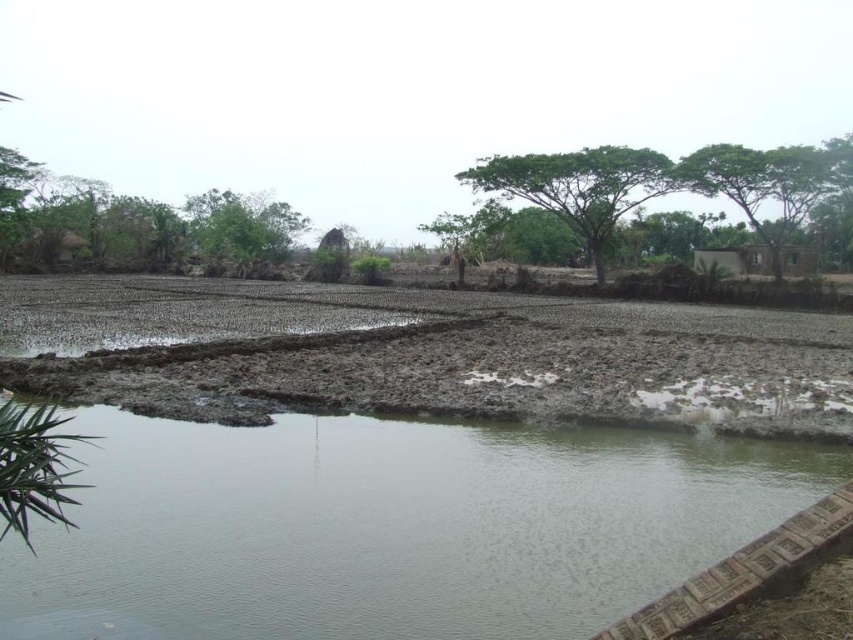
You are standing at the edge of the rural landscape and want to walk to the green leafy tree at center. Which direction should you move relative to the brown muddy field at center?

Since the brown muddy field at center is in front of the green leafy tree at center, you should move away from the brown muddy field at center to reach the green leafy tree at center.

You are a farmer planning to plant crops in the brown muddy field at center and the green leafy tree at center. Which area would you choose if you want to ensure your crops receive more sunlight?

The green leafy tree at center is taller than the brown muddy field at center, so planting crops in the brown muddy field at center would allow them to receive more sunlight without obstruction from the tree.